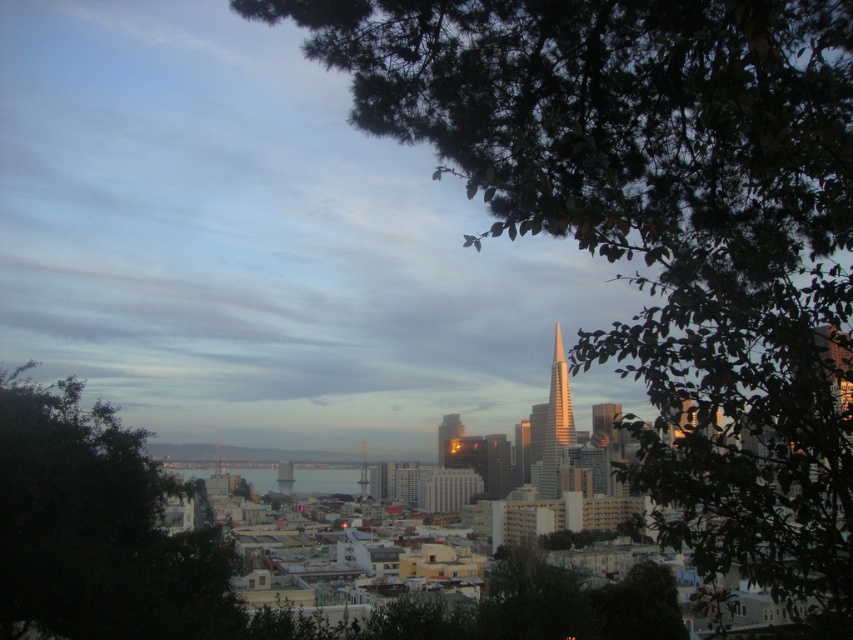
You are a city planner reviewing this area. The green leafy tree at left and the golden glass skyscraper at center are both in your proposal. Considering their sizes, which one might block more sunlight to the surrounding areas?

The green leafy tree at left is larger in size than the golden glass skyscraper at center, so it would block more sunlight to the surrounding areas.

You are a photographer standing in the city park and want to take a photo of the city skyline. You notice two points in the frame labeled as point 1 at coordinate (550, 484) and point 2 at coordinate (438, 433). Which point is closer to your camera?

Point 2 at coordinate (438, 433) is closer to the camera because it is positioned behind point 1 at coordinate (550, 484), which is further away from the viewer.